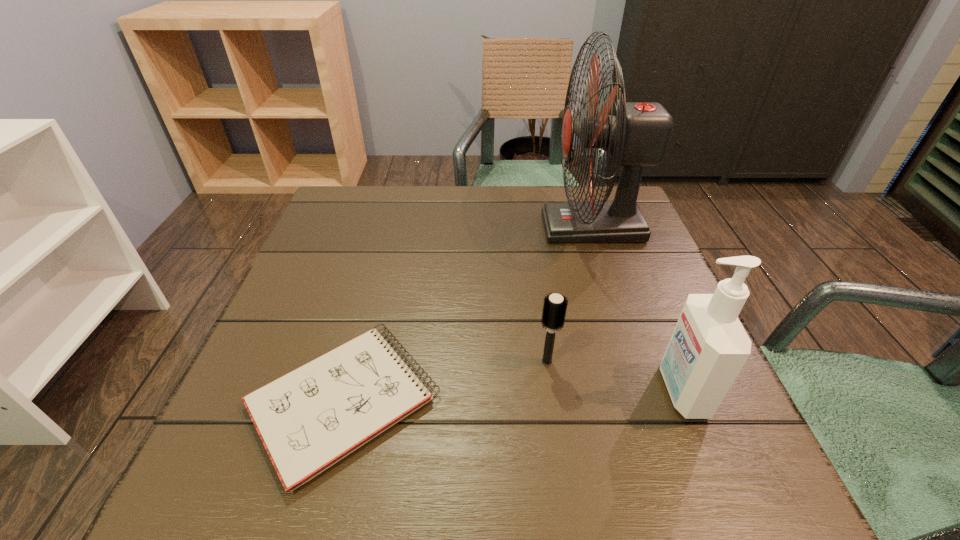
Identify the location of vacant position in the image that satisfies the following two spatial constraints: 1. on the front label of the second tallest object; 2. on the front side of the notepad. The height and width of the screenshot is (540, 960). (686, 402).

You are a GUI agent. You are given a task and a screenshot of the screen. Output one action in this format:
    pyautogui.click(x=<x>, y=<y>)
    Task: Click on the free location that satisfies the following two spatial constraints: 1. on the front-facing side of the fan; 2. on the front side of the second object from left to right
    The width and height of the screenshot is (960, 540).
    Given the screenshot: What is the action you would take?
    pyautogui.click(x=637, y=362)

Identify the location of free space in the image that satisfies the following two spatial constraints: 1. on the front-facing side of the fan; 2. on the front side of the hairbrush. (637, 362).